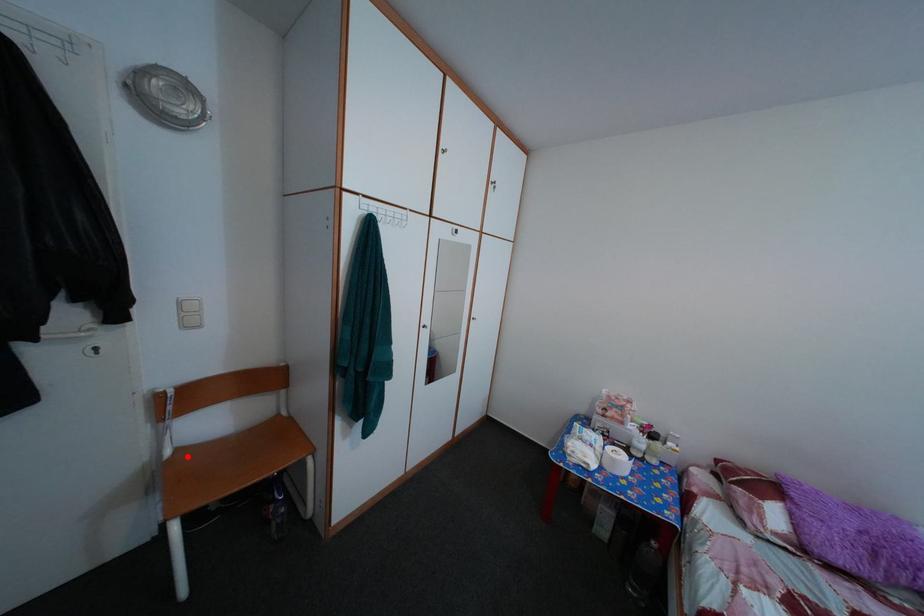
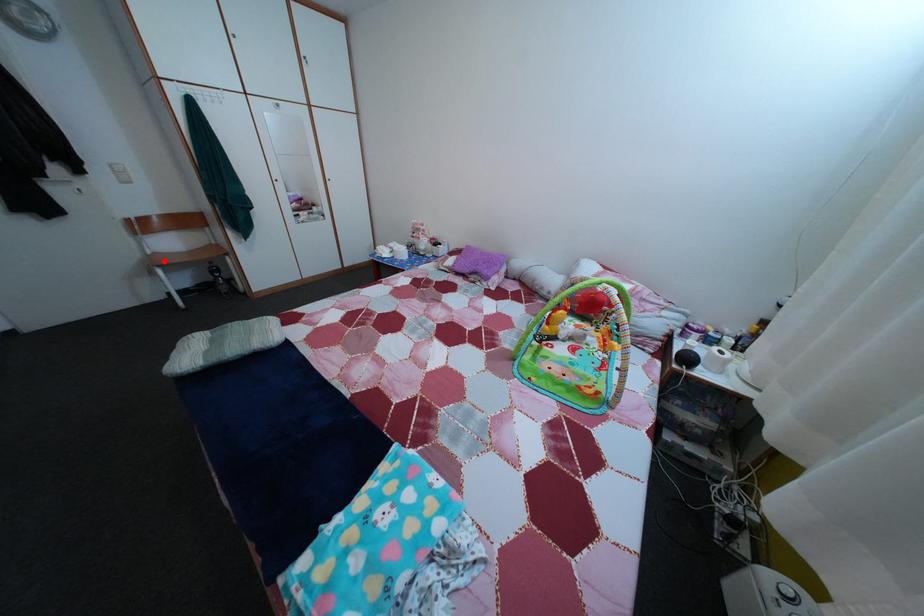
I am providing you with two images of the same scene from different viewpoints. A red point is marked on the first image and another point is marked on the second image. Do the highlighted points in image1 and image2 indicate the same real-world spot?

Yes